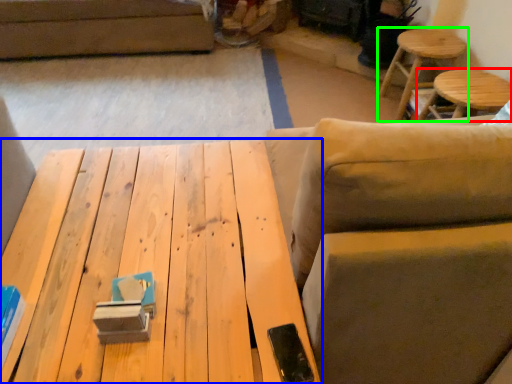
Question: Which is nearer to the stool (highlighted by a red box)? table (highlighted by a blue box) or stool (highlighted by a green box).

Choices:
 (A) table
 (B) stool

Answer: (B)